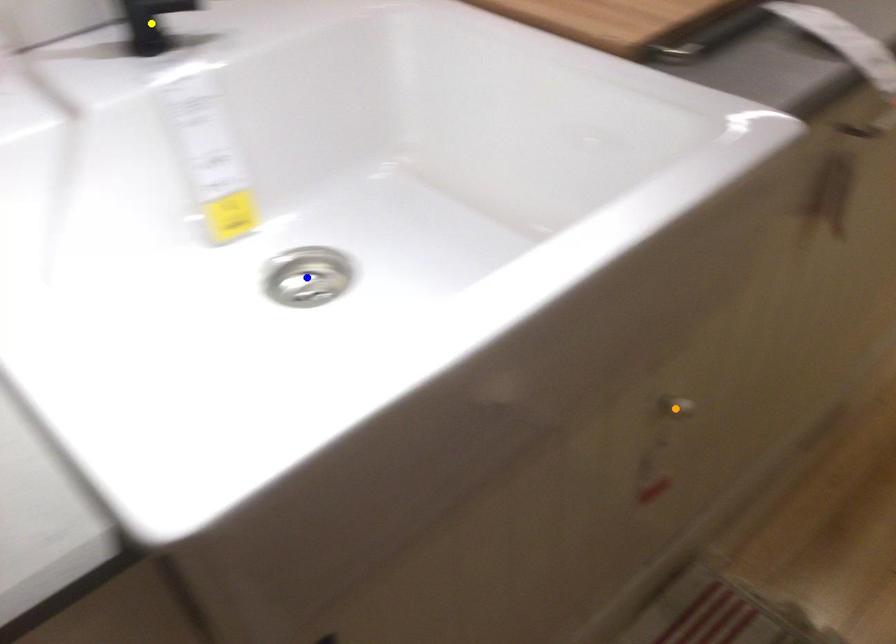
Order these from nearest to farthest:
- orange point
- yellow point
- blue point

orange point, blue point, yellow point